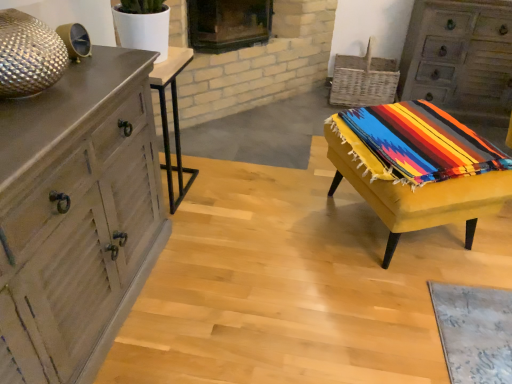
Describe the element at coordinates (460, 58) in the screenshot. This screenshot has height=384, width=512. I see `rustic wood chest of drawers at upper right, the first chest of drawers when ordered from top to bottom` at that location.

How much space does rustic wood chest of drawers at upper right, which appears as the first chest of drawers when viewed from the back, occupy horizontally?

rustic wood chest of drawers at upper right, which appears as the first chest of drawers when viewed from the back, is 19.33 inches wide.

What is the approximate height of wooden table at left, placed as the 2th table when sorted from right to left?

It is 27.33 inches.

You are a GUI agent. You are given a task and a screenshot of the screen. Output one action in this format:
    pyautogui.click(x=<x>, y=<y>)
    Task: Click on the black glass fireplace at upper center
    The height and width of the screenshot is (384, 512).
    Given the screenshot: What is the action you would take?
    pyautogui.click(x=228, y=24)

What do you see at coordinates (411, 187) in the screenshot? The image size is (512, 384). I see `yellow fabric-covered stool at right, which is the 2th table from left to right` at bounding box center [411, 187].

You are a GUI agent. You are given a task and a screenshot of the screen. Output one action in this format:
    pyautogui.click(x=<x>, y=<y>)
    Task: Click on the yellow fabric-covered stool at right, which is the 2th table from left to right
    
    Given the screenshot: What is the action you would take?
    pyautogui.click(x=411, y=187)

This screenshot has height=384, width=512. What are the coordinates of `rustic wood chest of drawers at upper right, which appears as the first chest of drawers when viewed from the right` in the screenshot? It's located at (460, 58).

From the image's perspective, count 2nd chest of drawerss downward from the black glass fireplace at upper center and point to it. Please provide its 2D coordinates.

[(76, 216)]

Which object is more forward, wooden chest of drawers at left, placed as the 1th chest of drawers when sorted from front to back, or black glass fireplace at upper center?

wooden chest of drawers at left, placed as the 1th chest of drawers when sorted from front to back.

From the image's perspective, is wooden chest of drawers at left, the 2th chest of drawers when ordered from right to left, over black glass fireplace at upper center?

Actually, wooden chest of drawers at left, the 2th chest of drawers when ordered from right to left, appears below black glass fireplace at upper center in the image.

Can you tell me how much wooden chest of drawers at left, which is counted as the 2th chest of drawers, starting from the back, and black glass fireplace at upper center differ in facing direction?

42.6 degrees separate the facing orientations of wooden chest of drawers at left, which is counted as the 2th chest of drawers, starting from the back, and black glass fireplace at upper center.

From the picture: Is wooden chest of drawers at left, which is counted as the 2th chest of drawers, starting from the back, not inside wooden table at left, placed as the 2th table when sorted from right to left?

Indeed, wooden chest of drawers at left, which is counted as the 2th chest of drawers, starting from the back, is completely outside wooden table at left, placed as the 2th table when sorted from right to left.

Based on the photo, how different are the orientations of wooden chest of drawers at left, which is counted as the 2th chest of drawers, starting from the back, and wooden table at left, placed as the 2th table when sorted from right to left, in degrees?

There is a 1.25-degree angle between the facing directions of wooden chest of drawers at left, which is counted as the 2th chest of drawers, starting from the back, and wooden table at left, placed as the 2th table when sorted from right to left.

Considering the positions of point (5, 366) and point (160, 78), is point (5, 366) closer or farther from the camera than point (160, 78)?

Point (5, 366) is positioned closer to the camera compared to point (160, 78).

From the picture: Which is correct: wooden table at left, placed as the 2th table when sorted from right to left, is inside yellow fabric-covered stool at right, acting as the 1th table starting from the right, or outside of it?

wooden table at left, placed as the 2th table when sorted from right to left, is not enclosed by yellow fabric-covered stool at right, acting as the 1th table starting from the right.

Are wooden table at left, placed as the 2th table when sorted from right to left, and yellow fabric-covered stool at right, acting as the 1th table starting from the right, far apart?

Yes, wooden table at left, placed as the 2th table when sorted from right to left, and yellow fabric-covered stool at right, acting as the 1th table starting from the right, are quite far apart.

Considering their positions, is wooden table at left, which is the first table in left-to-right order, located in front of or behind yellow fabric-covered stool at right, acting as the 1th table starting from the right?

Clearly, wooden table at left, which is the first table in left-to-right order, is behind yellow fabric-covered stool at right, acting as the 1th table starting from the right.

Which point is more forward, (153,81) or (394,120)?

The point (153,81) is more forward.

From a real-world perspective, which object stands above the other?

wooden chest of drawers at left, which is the first chest of drawers in bottom-to-top order, is physically above.

Does point (86, 251) lie behind point (500, 50)?

No.

Is wooden chest of drawers at left, which is the first chest of drawers in bottom-to-top order, looking in the opposite direction of rustic wood chest of drawers at upper right, the second chest of drawers when ordered from front to back?

No.

What's the angular difference between wooden chest of drawers at left, the second chest of drawers in the top-to-bottom sequence, and rustic wood chest of drawers at upper right, which appears as the first chest of drawers when viewed from the back,'s facing directions?

They differ by 90.1 degrees in their facing directions.

Is rustic wood chest of drawers at upper right, the first chest of drawers when ordered from top to bottom, next to wooden table at left, which is the first table in left-to-right order, and touching it?

rustic wood chest of drawers at upper right, the first chest of drawers when ordered from top to bottom, and wooden table at left, which is the first table in left-to-right order, are not in contact.

Is rustic wood chest of drawers at upper right, placed as the 2th chest of drawers when sorted from left to right, oriented towards wooden table at left, placed as the 2th table when sorted from right to left?

No, rustic wood chest of drawers at upper right, placed as the 2th chest of drawers when sorted from left to right, is not facing towards wooden table at left, placed as the 2th table when sorted from right to left.

In terms of height, does rustic wood chest of drawers at upper right, acting as the 2th chest of drawers starting from the bottom, look taller or shorter compared to wooden table at left, placed as the 2th table when sorted from right to left?

Clearly, rustic wood chest of drawers at upper right, acting as the 2th chest of drawers starting from the bottom, is taller compared to wooden table at left, placed as the 2th table when sorted from right to left.

From the image's perspective, is rustic wood chest of drawers at upper right, which appears as the first chest of drawers when viewed from the back, located above wooden table at left, placed as the 2th table when sorted from right to left?

Yes, from the image's perspective, rustic wood chest of drawers at upper right, which appears as the first chest of drawers when viewed from the back, is over wooden table at left, placed as the 2th table when sorted from right to left.

Considering the positions of objects rustic wood chest of drawers at upper right, which appears as the first chest of drawers when viewed from the right, and yellow fabric-covered stool at right, which is the 2th table from left to right, in the image provided, who is more to the left, rustic wood chest of drawers at upper right, which appears as the first chest of drawers when viewed from the right, or yellow fabric-covered stool at right, which is the 2th table from left to right,?

yellow fabric-covered stool at right, which is the 2th table from left to right.

Considering the sizes of objects rustic wood chest of drawers at upper right, which appears as the first chest of drawers when viewed from the back, and yellow fabric-covered stool at right, which is the 2th table from left to right, in the image provided, who is bigger, rustic wood chest of drawers at upper right, which appears as the first chest of drawers when viewed from the back, or yellow fabric-covered stool at right, which is the 2th table from left to right,?

rustic wood chest of drawers at upper right, which appears as the first chest of drawers when viewed from the back, is bigger.

Identify the location of the chest of drawers that is the 1st one above the yellow fabric-covered stool at right, which is the 2th table from left to right (from a real-world perspective). (460, 58).

Does rustic wood chest of drawers at upper right, the second chest of drawers when ordered from front to back, contain yellow fabric-covered stool at right, which is the 2th table from left to right?

Definitely not — yellow fabric-covered stool at right, which is the 2th table from left to right, is not inside rustic wood chest of drawers at upper right, the second chest of drawers when ordered from front to back.

Which of these two, rustic wood chest of drawers at upper right, which appears as the first chest of drawers when viewed from the right, or wooden chest of drawers at left, placed as the 1th chest of drawers when sorted from front to back, stands taller?

rustic wood chest of drawers at upper right, which appears as the first chest of drawers when viewed from the right.

Can you confirm if rustic wood chest of drawers at upper right, the first chest of drawers when ordered from top to bottom, is wider than wooden chest of drawers at left, the second chest of drawers in the top-to-bottom sequence?

Incorrect, the width of rustic wood chest of drawers at upper right, the first chest of drawers when ordered from top to bottom, does not surpass that of wooden chest of drawers at left, the second chest of drawers in the top-to-bottom sequence.

Can you confirm if rustic wood chest of drawers at upper right, acting as the 2th chest of drawers starting from the bottom, is positioned to the left of wooden chest of drawers at left, the 2th chest of drawers when ordered from right to left?

No, rustic wood chest of drawers at upper right, acting as the 2th chest of drawers starting from the bottom, is not to the left of wooden chest of drawers at left, the 2th chest of drawers when ordered from right to left.

Consider the image. Which is in front, rustic wood chest of drawers at upper right, the second chest of drawers when ordered from front to back, or wooden chest of drawers at left, placed as the 1th chest of drawers when sorted from front to back?

wooden chest of drawers at left, placed as the 1th chest of drawers when sorted from front to back, is more forward.

Find the location of a particular element. This screenshot has width=512, height=384. the chest of drawers that is the 2nd object located below the black glass fireplace at upper center (from the image's perspective) is located at coordinates (76, 216).

Where is `the 1st table to the right when counting from the wooden chest of drawers at left, placed as the 1th chest of drawers when sorted from front to back`? the 1st table to the right when counting from the wooden chest of drawers at left, placed as the 1th chest of drawers when sorted from front to back is located at coordinates (173, 118).

Considering their positions, is wooden table at left, which is the first table in left-to-right order, positioned further to black glass fireplace at upper center than wooden chest of drawers at left, the second chest of drawers in the top-to-bottom sequence?

wooden chest of drawers at left, the second chest of drawers in the top-to-bottom sequence, is further to black glass fireplace at upper center.

Looking at the image, which one is located closer to wooden chest of drawers at left, the second chest of drawers in the top-to-bottom sequence, yellow fabric-covered stool at right, acting as the 1th table starting from the right, or wooden table at left, which is the first table in left-to-right order?

wooden table at left, which is the first table in left-to-right order.

Estimate the real-world distances between objects in this image. Which object is closer to rustic wood chest of drawers at upper right, which appears as the first chest of drawers when viewed from the back, yellow fabric-covered stool at right, acting as the 1th table starting from the right, or black glass fireplace at upper center?

Among the two, yellow fabric-covered stool at right, acting as the 1th table starting from the right, is located nearer to rustic wood chest of drawers at upper right, which appears as the first chest of drawers when viewed from the back.

Estimate the real-world distances between objects in this image. Which object is further from black glass fireplace at upper center, wooden chest of drawers at left, the second chest of drawers in the top-to-bottom sequence, or yellow fabric-covered stool at right, which is the 2th table from left to right?

Based on the image, wooden chest of drawers at left, the second chest of drawers in the top-to-bottom sequence, appears to be further to black glass fireplace at upper center.

Estimate the real-world distances between objects in this image. Which object is further from wooden table at left, placed as the 2th table when sorted from right to left, yellow fabric-covered stool at right, which is the 2th table from left to right, or black glass fireplace at upper center?

The object further to wooden table at left, placed as the 2th table when sorted from right to left, is yellow fabric-covered stool at right, which is the 2th table from left to right.

Estimate the real-world distances between objects in this image. Which object is closer to rustic wood chest of drawers at upper right, which appears as the first chest of drawers when viewed from the back, black glass fireplace at upper center or wooden table at left, placed as the 2th table when sorted from right to left?

black glass fireplace at upper center.

Estimate the real-world distances between objects in this image. Which object is closer to wooden table at left, placed as the 2th table when sorted from right to left, black glass fireplace at upper center or wooden chest of drawers at left, which is counted as the 2th chest of drawers, starting from the back?

The object closer to wooden table at left, placed as the 2th table when sorted from right to left, is black glass fireplace at upper center.

Considering their positions, is rustic wood chest of drawers at upper right, placed as the 2th chest of drawers when sorted from left to right, positioned closer to wooden table at left, which is the first table in left-to-right order, than wooden chest of drawers at left, marked as the 1th chest of drawers in a left-to-right arrangement?

Among the two, wooden chest of drawers at left, marked as the 1th chest of drawers in a left-to-right arrangement, is located nearer to wooden table at left, which is the first table in left-to-right order.

You are a GUI agent. You are given a task and a screenshot of the screen. Output one action in this format:
    pyautogui.click(x=<x>, y=<y>)
    Task: Click on the fireplace between wooden table at left, which is the first table in left-to-right order, and rustic wood chest of drawers at upper right, placed as the 2th chest of drawers when sorted from left to right, from left to right
    The width and height of the screenshot is (512, 384).
    Given the screenshot: What is the action you would take?
    pyautogui.click(x=228, y=24)

Where is `fireplace between wooden table at left, placed as the 2th table when sorted from right to left, and yellow fabric-covered stool at right, acting as the 1th table starting from the right, from left to right`? The image size is (512, 384). fireplace between wooden table at left, placed as the 2th table when sorted from right to left, and yellow fabric-covered stool at right, acting as the 1th table starting from the right, from left to right is located at coordinates (228, 24).

Where is `table located between wooden table at left, which is the first table in left-to-right order, and rustic wood chest of drawers at upper right, the second chest of drawers when ordered from front to back, in the left-right direction`? The image size is (512, 384). table located between wooden table at left, which is the first table in left-to-right order, and rustic wood chest of drawers at upper right, the second chest of drawers when ordered from front to back, in the left-right direction is located at coordinates (411, 187).

Find the location of a particular element. fireplace between wooden chest of drawers at left, the 2th chest of drawers when ordered from right to left, and rustic wood chest of drawers at upper right, placed as the 2th chest of drawers when sorted from left to right, in the horizontal direction is located at coordinates (228, 24).